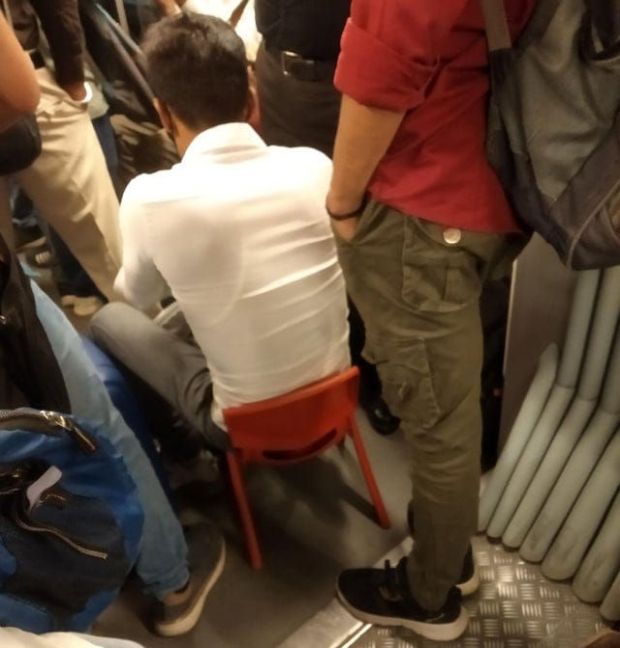
Where is `floor`? The width and height of the screenshot is (620, 648). floor is located at coordinates (516, 642).